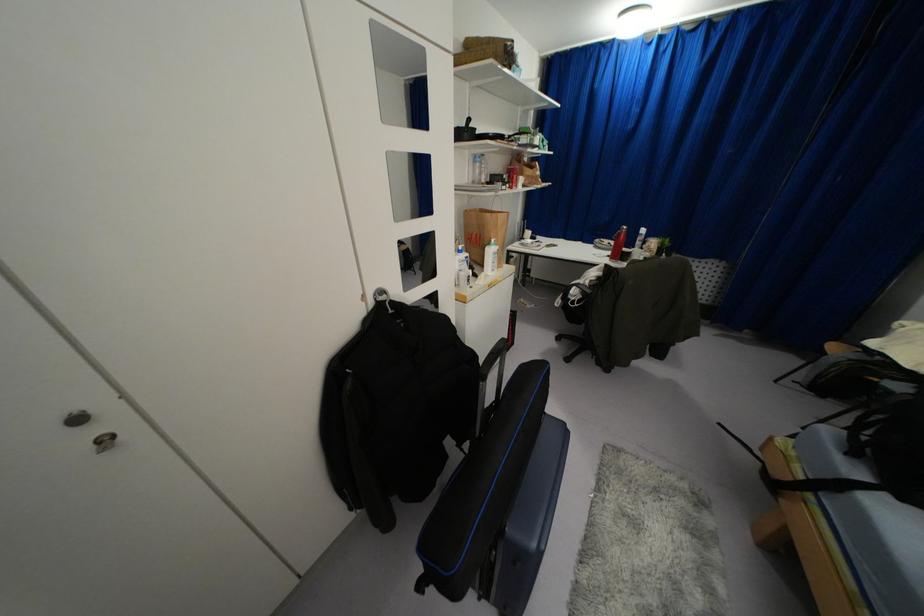
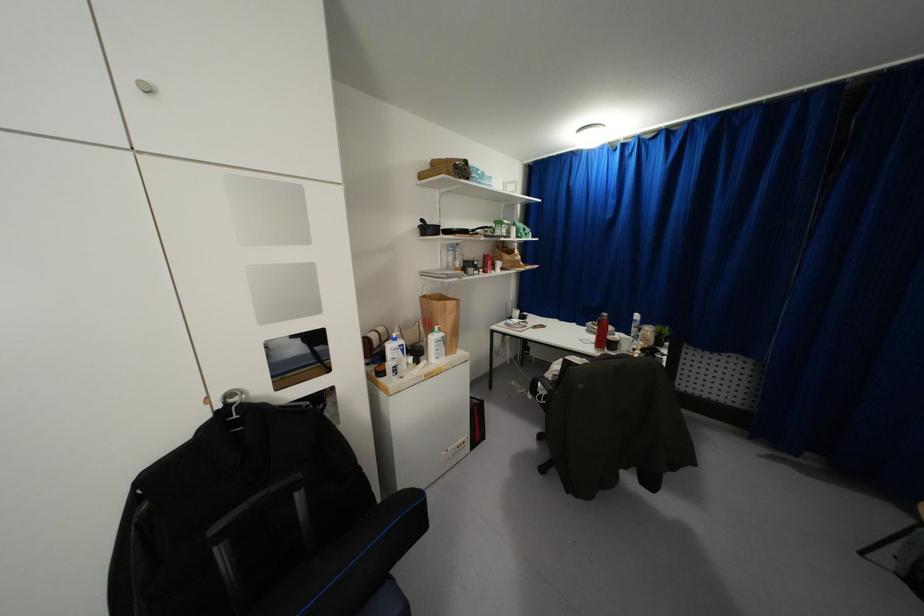
The point at [590,281] is marked in the first image. Where is the corresponding point in the second image?

(553, 376)